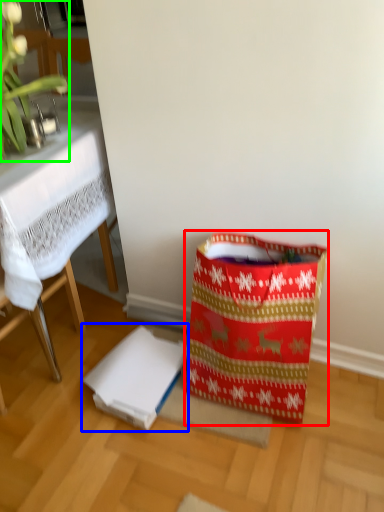
Question: Which object is positioned farthest from shopping bag (highlighted by a red box)? Select from cardboard box (highlighted by a blue box) and orchid (highlighted by a green box).

Choices:
 (A) cardboard box
 (B) orchid

Answer: (B)